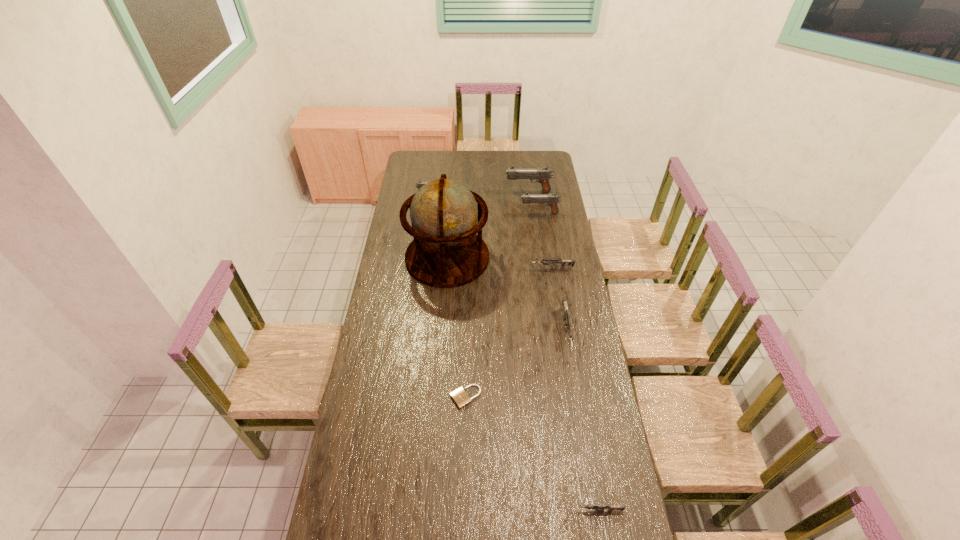
Locate an element on the screen. Image resolution: width=960 pixels, height=540 pixels. vacant space situated 0.130m on the right of the padlock is located at coordinates (516, 397).

I want to click on globe located at the left edge, so click(x=446, y=252).

Locate an element on the screen. gun at the left edge is located at coordinates (420, 183).

Locate an element on the screen. The image size is (960, 540). vacant space at the far edge of the desktop is located at coordinates (500, 164).

Find the location of a particular element. The image size is (960, 540). free region at the left edge is located at coordinates (402, 233).

You are a GUI agent. You are given a task and a screenshot of the screen. Output one action in this format:
    pyautogui.click(x=<x>, y=<y>)
    Task: Click on the vacant position at the right edge of the desktop
    This screenshot has width=960, height=540.
    Given the screenshot: What is the action you would take?
    pyautogui.click(x=568, y=302)

At what (x,y) coordinates should I click in order to perform the action: click on vacant point at the far right corner. Please return your answer as a coordinate pair (x, y). The height and width of the screenshot is (540, 960). Looking at the image, I should click on (530, 164).

The image size is (960, 540). I want to click on vacant space that is in between the nearest gun and the second shortest gun, so click(574, 389).

This screenshot has height=540, width=960. In order to click on free point between the third shortest gun and the second smallest grey gun in this screenshot , I will do (x=559, y=299).

The image size is (960, 540). I want to click on vacant area that lies between the nearest grey gun and the third shortest gun, so click(x=582, y=420).